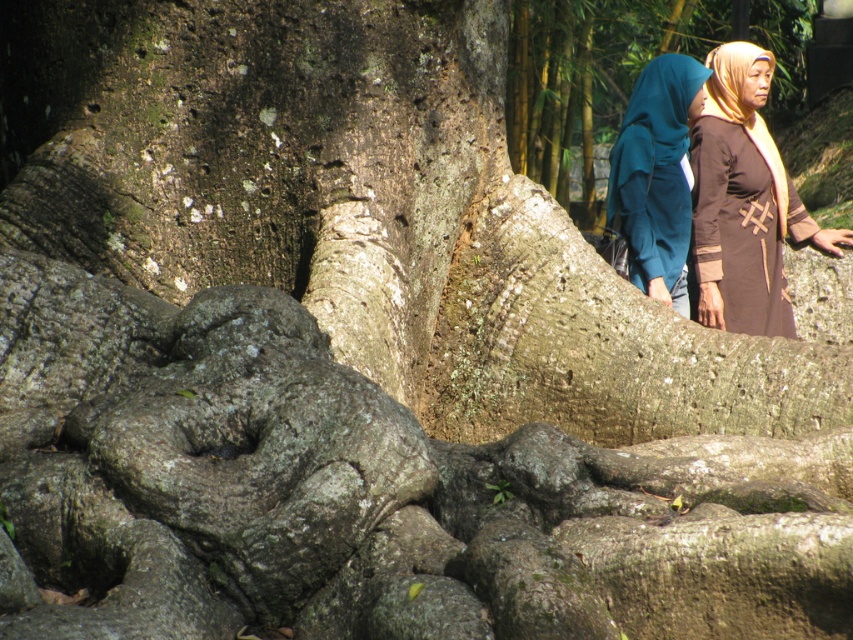
You are an artist planning to paint the scene of the large tree with its roots and the background trees. You have two fabric items to include in your painting for cultural context. Which fabric item, the brown matte robe at right or the teal fabric hijab at upper right, should you place lower in the painting to ensure proper perspective?

The brown matte robe at right should be placed lower in the painting because it is not as tall as the teal fabric hijab at upper right, ensuring proper perspective by positioning shorter objects lower.